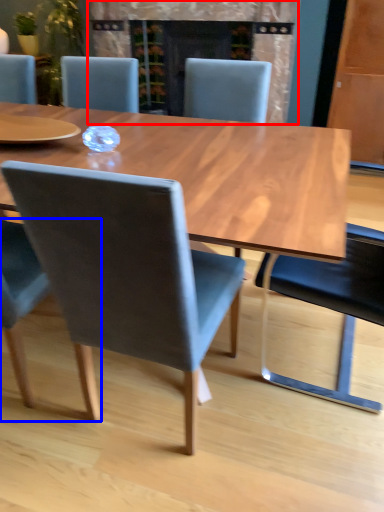
Question: Among these objects, which one is farthest to the camera, fireplace (highlighted by a red box) or chair (highlighted by a blue box)?

Choices:
 (A) fireplace
 (B) chair

Answer: (A)